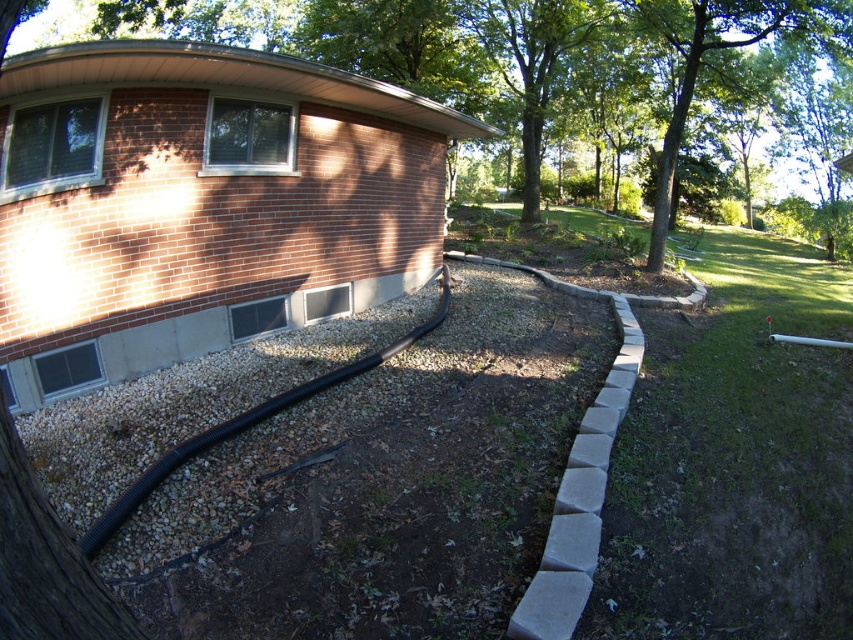
How distant is gray gravel at lower left from green leafy tree at upper right?

They are 8.46 meters apart.

Does point (218, 509) lie in front of point (756, 4)?

Yes.

At what (x,y) coordinates should I click in order to perform the action: click on gray gravel at lower left. Please return your answer as a coordinate pair (x, y). Looking at the image, I should click on (381, 486).

Between point (447, 333) and point (160, 458), which one is positioned behind?

Positioned behind is point (447, 333).

Which of these two, gray gravel at lower left or black rubber garden hose at lower left, stands shorter?

Standing shorter between the two is gray gravel at lower left.

Where is `gray gravel at lower left`? gray gravel at lower left is located at coordinates (381, 486).

Who is more distant from viewer, (x=610, y=156) or (x=194, y=442)?

Point (x=610, y=156)

Does brown brick tree at upper center have a smaller size compared to black rubber garden hose at lower left?

Incorrect, brown brick tree at upper center is not smaller in size than black rubber garden hose at lower left.

Is point (614, 67) behind point (402, 337)?

That is True.

In order to click on brown brick tree at upper center in this screenshot , I will do (x=581, y=81).